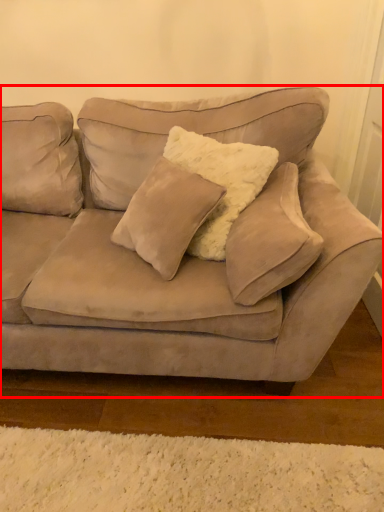
Question: From the image's perspective, where is studio couch (annotated by the red box) located in relation to pillow in the image?

Choices:
 (A) above
 (B) below

Answer: (A)